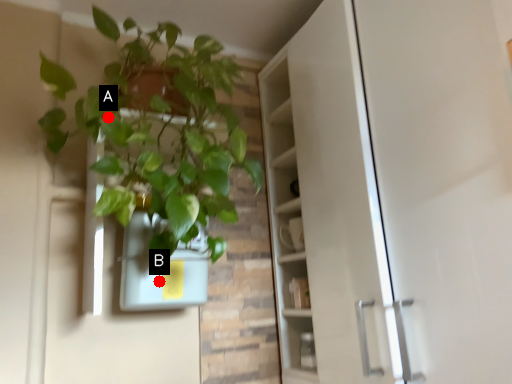
Question: Two points are circled on the image, labeled by A and B beside each circle. Which point appears closest to the camera in this image?

Choices:
 (A) A is closer
 (B) B is closer

Answer: (A)